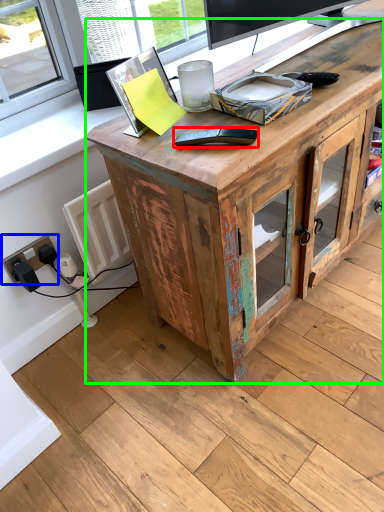
Question: Which is nearer to the equipment (highlighted by a red box)? electric outlet (highlighted by a blue box) or desk (highlighted by a green box).

Choices:
 (A) electric outlet
 (B) desk

Answer: (B)